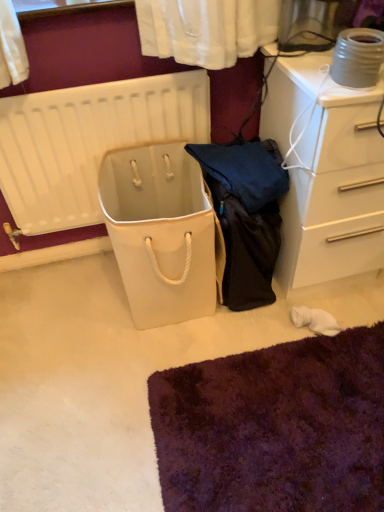
Question: Does white glossy chest of drawers at upper right turn towards white matte radiator at left?

Choices:
 (A) yes
 (B) no

Answer: (B)

Question: Would you say white glossy chest of drawers at upper right contains white matte radiator at left?

Choices:
 (A) yes
 (B) no

Answer: (B)

Question: From the image's perspective, is white glossy chest of drawers at upper right beneath white matte radiator at left?

Choices:
 (A) no
 (B) yes

Answer: (A)

Question: Is white glossy chest of drawers at upper right far away from white matte radiator at left?

Choices:
 (A) yes
 (B) no

Answer: (B)

Question: Does white glossy chest of drawers at upper right have a lesser height compared to white matte radiator at left?

Choices:
 (A) no
 (B) yes

Answer: (A)

Question: Does white glossy chest of drawers at upper right lie behind white matte radiator at left?

Choices:
 (A) no
 (B) yes

Answer: (A)

Question: Is white matte radiator at left closer to camera compared to white glossy chest of drawers at upper right?

Choices:
 (A) no
 (B) yes

Answer: (A)

Question: From the image's perspective, is white matte radiator at left on top of white glossy chest of drawers at upper right?

Choices:
 (A) no
 (B) yes

Answer: (A)

Question: Is white matte radiator at left further to camera compared to white glossy chest of drawers at upper right?

Choices:
 (A) no
 (B) yes

Answer: (B)

Question: Does white matte radiator at left have a greater height compared to white glossy chest of drawers at upper right?

Choices:
 (A) yes
 (B) no

Answer: (B)

Question: Can you confirm if white matte radiator at left is positioned to the right of white glossy chest of drawers at upper right?

Choices:
 (A) yes
 (B) no

Answer: (B)

Question: From a real-world perspective, is white matte radiator at left located higher than white glossy chest of drawers at upper right?

Choices:
 (A) no
 (B) yes

Answer: (B)

Question: Would you say white matte radiator at left is inside or outside white glossy chest of drawers at upper right?

Choices:
 (A) inside
 (B) outside

Answer: (B)